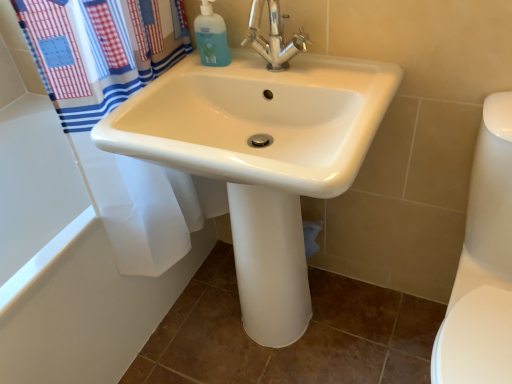
Question: From the image's perspective, does translucent plastic bottle at upper center appear lower than white glossy bathtub at lower left?

Choices:
 (A) yes
 (B) no

Answer: (B)

Question: Is translucent plastic bottle at upper center taller than white glossy bathtub at lower left?

Choices:
 (A) no
 (B) yes

Answer: (A)

Question: Does translucent plastic bottle at upper center turn towards white glossy bathtub at lower left?

Choices:
 (A) no
 (B) yes

Answer: (A)

Question: Is the position of translucent plastic bottle at upper center less distant than that of white glossy bathtub at lower left?

Choices:
 (A) yes
 (B) no

Answer: (B)

Question: Does translucent plastic bottle at upper center have a larger size compared to white glossy bathtub at lower left?

Choices:
 (A) yes
 (B) no

Answer: (B)

Question: From a real-world perspective, is translucent plastic bottle at upper center on white glossy bathtub at lower left?

Choices:
 (A) no
 (B) yes

Answer: (B)

Question: Is white glossy sink at center bigger than white glossy toilet bowl at right?

Choices:
 (A) yes
 (B) no

Answer: (A)

Question: Can white glossy toilet bowl at right be found inside white glossy sink at center?

Choices:
 (A) no
 (B) yes

Answer: (A)

Question: From a real-world perspective, does white glossy sink at center stand above white glossy toilet bowl at right?

Choices:
 (A) no
 (B) yes

Answer: (B)

Question: Is white glossy sink at center positioned beyond the bounds of white glossy toilet bowl at right?

Choices:
 (A) no
 (B) yes

Answer: (B)

Question: Is white glossy sink at center wider than white glossy toilet bowl at right?

Choices:
 (A) yes
 (B) no

Answer: (B)

Question: From the image's perspective, is white glossy sink at center under white glossy toilet bowl at right?

Choices:
 (A) no
 (B) yes

Answer: (A)

Question: Does polished chrome faucet at center turn towards white glossy bathtub at lower left?

Choices:
 (A) yes
 (B) no

Answer: (B)